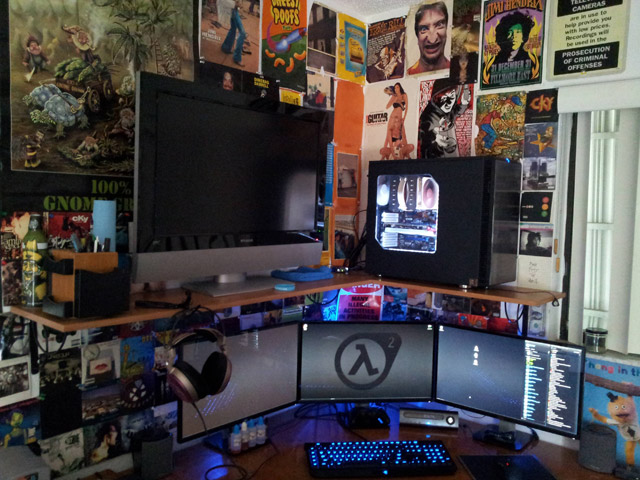
Locate an element on the screen. speaker is located at coordinates click(x=604, y=443).